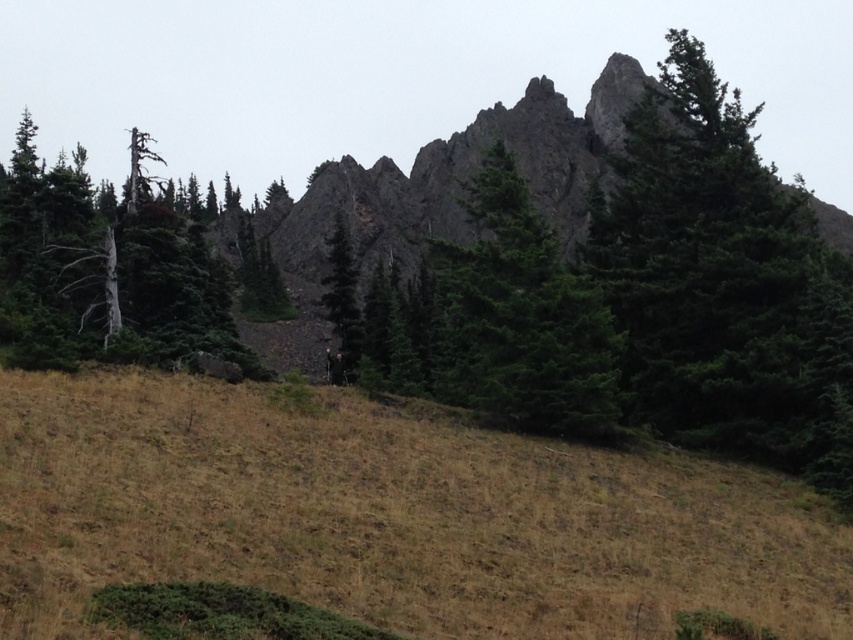
Can you confirm if green matte tree at upper right is shorter than green matte tree at center?

Incorrect, green matte tree at upper right's height does not fall short of green matte tree at center's.

Between point (698, 198) and point (349, 360), which one is positioned in front?

Point (698, 198)

Which is in front, point (757, 257) or point (349, 269)?

Point (757, 257) is in front.

This screenshot has height=640, width=853. In order to click on green matte tree at upper right in this screenshot , I will do `click(717, 275)`.

Can you confirm if green matte tree at upper right is positioned below dead wood tree at left?

Yes.

Measure the distance between green matte tree at upper right and camera.

green matte tree at upper right is 32.43 meters from camera.

Measure the distance between green matte tree at upper right and camera.

green matte tree at upper right is 32.43 meters from camera.

Image resolution: width=853 pixels, height=640 pixels. Identify the location of green matte tree at upper right. (717, 275).

Between dry grass at center and dead wood tree at left, which one appears on the right side from the viewer's perspective?

dry grass at center

Between dry grass at center and dead wood tree at left, which one has more height?

dead wood tree at left is taller.

Describe the element at coordinates (389, 516) in the screenshot. I see `dry grass at center` at that location.

Where is `dry grass at center`? This screenshot has width=853, height=640. dry grass at center is located at coordinates (389, 516).